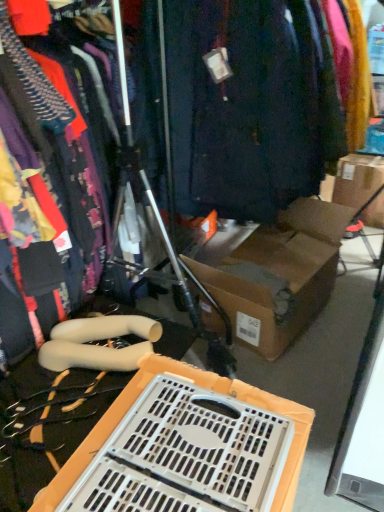
Question: Looking at their shapes, would you say brown cardboard box at upper right is wider or thinner than white plastic crate at lower center?

Choices:
 (A) wide
 (B) thin

Answer: (A)

Question: From a real-world perspective, relative to white plastic crate at lower center, is brown cardboard box at upper right vertically above or below?

Choices:
 (A) above
 (B) below

Answer: (B)

Question: Which is nearer to the white plastic crate at lower center?

Choices:
 (A) matte black dress at left
 (B) brown cardboard box at upper right
 (C) dark blue fabric at center

Answer: (A)

Question: Which of these objects is positioned closest to the white plastic crate at lower center?

Choices:
 (A) brown cardboard box at upper right
 (B) dark blue fabric at center
 (C) matte black dress at left

Answer: (C)